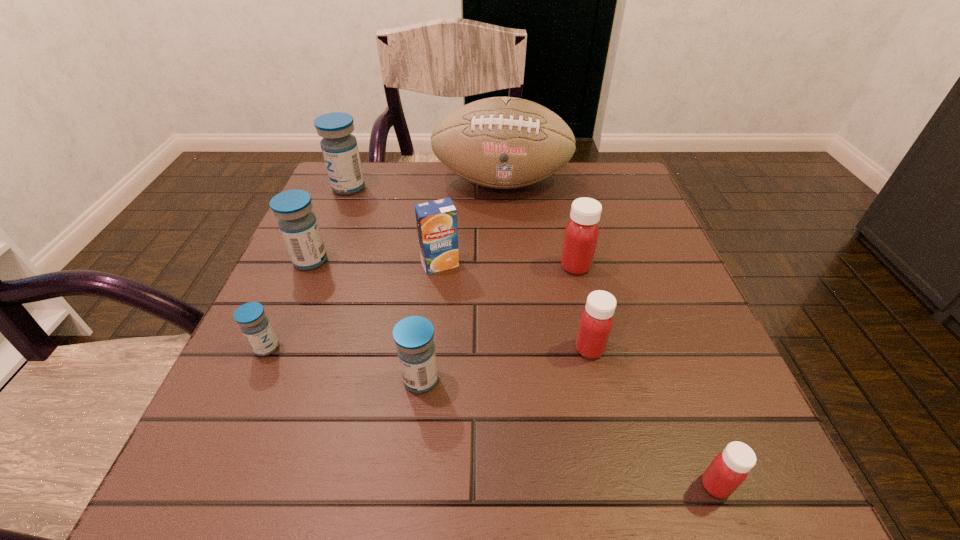
Locate an element on the screen. The height and width of the screenshot is (540, 960). vacant space at the far right corner is located at coordinates (620, 168).

The height and width of the screenshot is (540, 960). I want to click on vacant area that lies between the third smallest blue medicine and the third farthest blue medicine, so click(289, 304).

This screenshot has width=960, height=540. I want to click on free space that is in between the orange_juice and the biggest red medicine, so click(508, 265).

You are a GUI agent. You are given a task and a screenshot of the screen. Output one action in this format:
    pyautogui.click(x=<x>, y=<y>)
    Task: Click on the free space between the smallest red medicine and the second farthest red medicine
    The height and width of the screenshot is (540, 960).
    Given the screenshot: What is the action you would take?
    pyautogui.click(x=653, y=417)

The image size is (960, 540). Identify the location of vacant region between the rightmost medicine and the third farthest blue medicine. (492, 416).

In order to click on free space between the second nearest red medicine and the blue orange_juice in this screenshot , I will do `click(515, 306)`.

I want to click on vacant space that is in between the tallest object and the second tallest object, so click(425, 185).

Where is `free spot between the fourth medicine from left to right and the tallest medicine`? free spot between the fourth medicine from left to right and the tallest medicine is located at coordinates (385, 284).

Locate an element on the screen. The image size is (960, 540). empty space that is in between the biggest red medicine and the third farthest blue medicine is located at coordinates (421, 307).

Point out which object is positioned as the sixth nearest to the rightmost blue medicine. Please provide its 2D coordinates. Your answer should be formatted as a tuple, i.e. [(x, y)], where the tuple contains the x and y coordinates of a point satisfying the conditions above.

[(729, 469)]